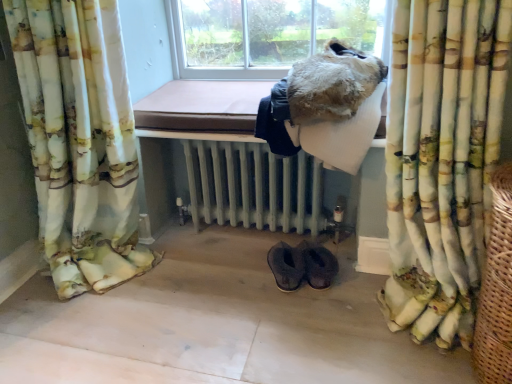
Question: Considering the relative positions of fuzzy fur coat at upper center and printed fabric curtain at right, acting as the 2th curtain starting from the left, in the image provided, is fuzzy fur coat at upper center to the left or to the right of printed fabric curtain at right, acting as the 2th curtain starting from the left,?

Choices:
 (A) right
 (B) left

Answer: (B)

Question: In terms of size, does fuzzy fur coat at upper center appear bigger or smaller than printed fabric curtain at right, which is counted as the first curtain, starting from the right?

Choices:
 (A) big
 (B) small

Answer: (B)

Question: Estimate the real-world distances between objects in this image. Which object is closer to the white painted radiator at center?

Choices:
 (A) floral fabric curtain at left, which appears as the 1th curtain when viewed from the left
 (B) woven brown basket at right
 (C) fuzzy fur coat at upper center
 (D) printed fabric curtain at right, acting as the 2th curtain starting from the left
 (E) brown suede slippers at lower center

Answer: (E)

Question: Estimate the real-world distances between objects in this image. Which object is closer to the floral fabric curtain at left, the 2th curtain in the right-to-left sequence?

Choices:
 (A) printed fabric curtain at right, acting as the 2th curtain starting from the left
 (B) brown suede slippers at lower center
 (C) woven brown basket at right
 (D) fuzzy fur coat at upper center
 (E) white painted radiator at center

Answer: (E)